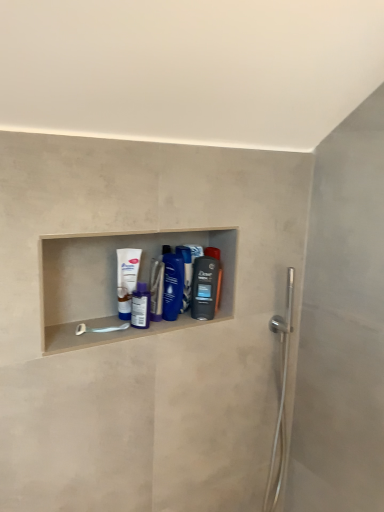
Question: Does translucent plastic mouthwash at center, the 1th mouthwash viewed from the right, appear on the left side of purple glossy mouthwash at center, which is the fourth mouthwash from right to left?

Choices:
 (A) no
 (B) yes

Answer: (A)

Question: From a real-world perspective, is translucent plastic mouthwash at center, which ranks as the fifth mouthwash in left-to-right order, positioned under purple glossy mouthwash at center, marked as the 2th mouthwash in a left-to-right arrangement, based on gravity?

Choices:
 (A) no
 (B) yes

Answer: (A)

Question: Considering the relative sizes of translucent plastic mouthwash at center, the 1th mouthwash viewed from the right, and purple glossy mouthwash at center, which is the fourth mouthwash from right to left, in the image provided, is translucent plastic mouthwash at center, the 1th mouthwash viewed from the right, shorter than purple glossy mouthwash at center, which is the fourth mouthwash from right to left,?

Choices:
 (A) no
 (B) yes

Answer: (A)

Question: Does translucent plastic mouthwash at center, the 1th mouthwash viewed from the right, turn towards purple glossy mouthwash at center, marked as the 2th mouthwash in a left-to-right arrangement?

Choices:
 (A) yes
 (B) no

Answer: (B)

Question: Is translucent plastic mouthwash at center, the 1th mouthwash viewed from the right, not near purple glossy mouthwash at center, which is the fourth mouthwash from right to left?

Choices:
 (A) yes
 (B) no

Answer: (B)

Question: Considering the positions of point (117, 293) and point (216, 304), is point (117, 293) closer or farther from the camera than point (216, 304)?

Choices:
 (A) farther
 (B) closer

Answer: (B)

Question: Is white glossy tube at center, acting as the fifth mouthwash starting from the right, taller or shorter than translucent plastic mouthwash at center, which ranks as the fifth mouthwash in left-to-right order?

Choices:
 (A) tall
 (B) short

Answer: (A)

Question: Is white glossy tube at center, acting as the fifth mouthwash starting from the right, wider or thinner than translucent plastic mouthwash at center, which ranks as the fifth mouthwash in left-to-right order?

Choices:
 (A) thin
 (B) wide

Answer: (A)

Question: In terms of size, does white glossy tube at center, the first mouthwash in the left-to-right sequence, appear bigger or smaller than translucent plastic mouthwash at center, which ranks as the fifth mouthwash in left-to-right order?

Choices:
 (A) small
 (B) big

Answer: (B)

Question: Is point (160, 300) closer or farther from the camera than point (165, 304)?

Choices:
 (A) closer
 (B) farther

Answer: (A)

Question: Considering their positions, is blue glossy bottle at center, positioned as the 3th mouthwash in right-to-left order, located in front of or behind blue glossy bottle at center, placed as the fourth mouthwash when sorted from left to right?

Choices:
 (A) behind
 (B) front

Answer: (A)

Question: In the image, is blue glossy bottle at center, marked as the third mouthwash in a left-to-right arrangement, on the left side or the right side of blue glossy bottle at center, acting as the second mouthwash starting from the right?

Choices:
 (A) left
 (B) right

Answer: (A)

Question: In terms of size, does blue glossy bottle at center, marked as the third mouthwash in a left-to-right arrangement, appear bigger or smaller than blue glossy bottle at center, acting as the second mouthwash starting from the right?

Choices:
 (A) small
 (B) big

Answer: (A)

Question: Looking at the image, does blue glossy bottle at center, acting as the second mouthwash starting from the right, seem bigger or smaller compared to white glossy tube at center, acting as the fifth mouthwash starting from the right?

Choices:
 (A) big
 (B) small

Answer: (B)

Question: Is blue glossy bottle at center, acting as the second mouthwash starting from the right, to the left or to the right of white glossy tube at center, acting as the fifth mouthwash starting from the right, in the image?

Choices:
 (A) right
 (B) left

Answer: (A)